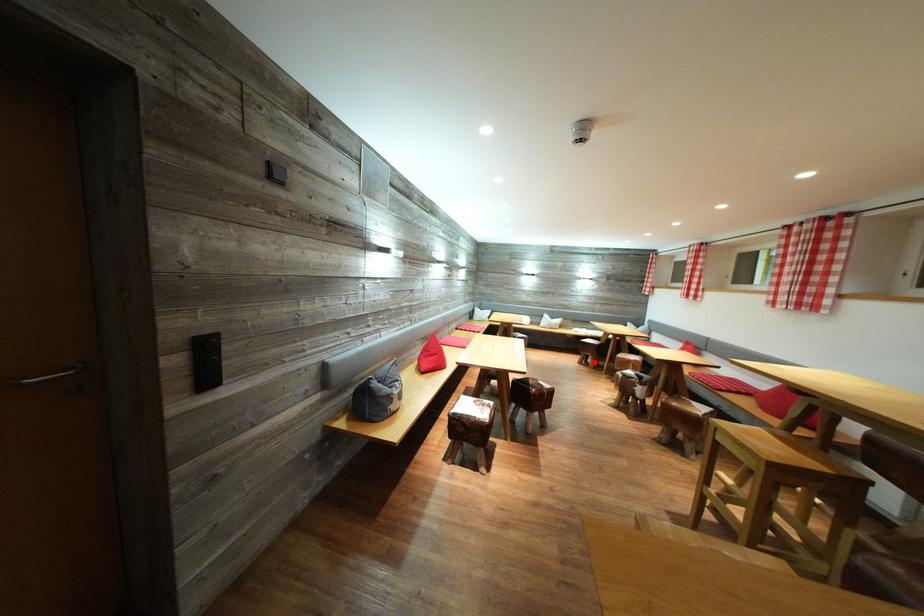
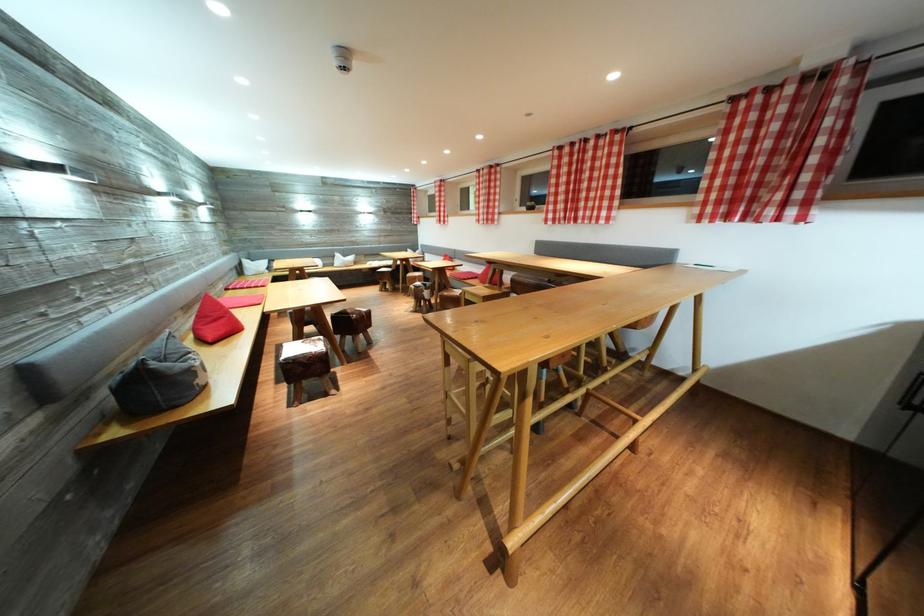
Find the pixel in the second image that matches the highlighted location in the first image.

(393, 289)